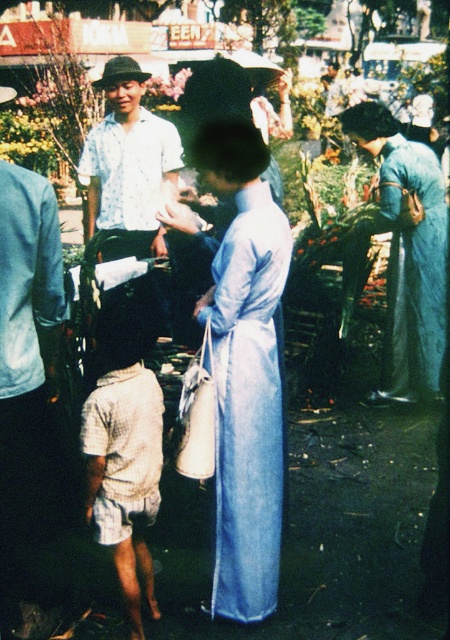
Does light blue silk ao dai at center have a lesser height compared to light blue shirt at center?

Incorrect, light blue silk ao dai at center's height does not fall short of light blue shirt at center's.

Who is more forward, (223, 525) or (176, 157)?

Point (223, 525)

At what (x,y) coordinates should I click in order to perform the action: click on light blue silk ao dai at center. Please return your answer as a coordinate pair (x, y). This screenshot has height=640, width=450. Looking at the image, I should click on (244, 371).

Is white checkered shorts at lower left wider than light blue shirt at center?

Result: No, white checkered shorts at lower left is not wider than light blue shirt at center.

Consider the image. How far apart are white checkered shorts at lower left and light blue shirt at center?

They are 1.84 meters apart.

Between point (142, 488) and point (104, 212), which one is positioned behind?

The point (104, 212) is behind.

This screenshot has width=450, height=640. I want to click on white checkered shorts at lower left, so click(x=124, y=451).

Does light blue silk ao dai at center come behind white checkered shorts at lower left?

Yes.

The height and width of the screenshot is (640, 450). In order to click on light blue silk ao dai at center in this screenshot , I will do `click(244, 371)`.

Find the location of `light blue silk ao dai at center`. light blue silk ao dai at center is located at coordinates pos(244,371).